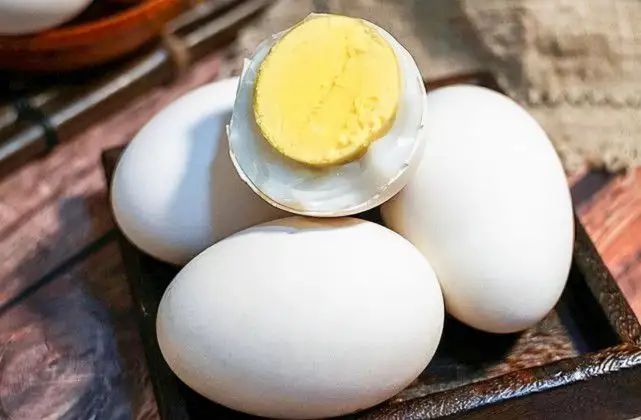
At what (x,y) coordinates should I click in order to perform the action: click on wall. Please return your answer as a coordinate pair (x, y). Looking at the image, I should click on (615, 34).